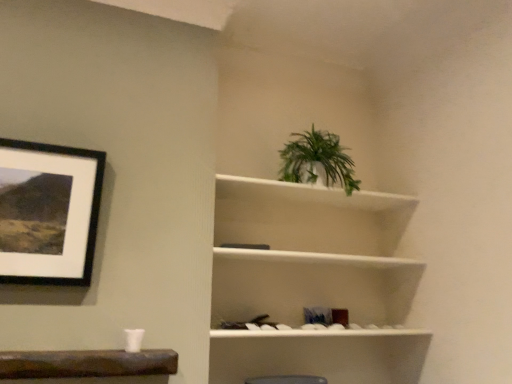
At what (x,y) coordinates should I click in order to perform the action: click on green leafy plant at upper center. Please return your answer as a coordinate pair (x, y). Looking at the image, I should click on (318, 161).

What do you see at coordinates (318, 161) in the screenshot? This screenshot has width=512, height=384. I see `green leafy plant at upper center` at bounding box center [318, 161].

The width and height of the screenshot is (512, 384). What do you see at coordinates (313, 282) in the screenshot?
I see `white matte shelf at upper right` at bounding box center [313, 282].

Where is `green leafy plant at upper center`? The height and width of the screenshot is (384, 512). green leafy plant at upper center is located at coordinates (318, 161).

From the image's perspective, which one is positioned lower, white matte shelf at upper right or black matte picture frame at upper left?

white matte shelf at upper right is shown below in the image.

Between white matte shelf at upper right and black matte picture frame at upper left, which one has larger width?

white matte shelf at upper right.

Measure the distance from white matte shelf at upper right to black matte picture frame at upper left.

They are 37.46 inches apart.

Is white matte shelf at upper right not within black matte picture frame at upper left?

Yes, white matte shelf at upper right is not within black matte picture frame at upper left.

Does point (89, 264) come farther from viewer compared to point (217, 298)?

No.

Considering their positions, is black matte picture frame at upper left located in front of or behind white matte shelf at upper right?

In the image, black matte picture frame at upper left appears in front of white matte shelf at upper right.

From the image's perspective, which one is positioned higher, black matte picture frame at upper left or white matte shelf at upper right?

black matte picture frame at upper left.

Is black matte picture frame at upper left not within white matte shelf at upper right?

Yes, black matte picture frame at upper left is not within white matte shelf at upper right.

From the picture: Who is taller, white matte shelf at upper right or green leafy plant at upper center?

Standing taller between the two is white matte shelf at upper right.

Which object is further away from the camera, white matte shelf at upper right or green leafy plant at upper center?

green leafy plant at upper center.

Considering the sizes of white matte shelf at upper right and green leafy plant at upper center in the image, is white matte shelf at upper right wider or thinner than green leafy plant at upper center?

white matte shelf at upper right is wider than green leafy plant at upper center.

From a real-world perspective, is white matte shelf at upper right above or below green leafy plant at upper center?

In terms of real-world spatial position, white matte shelf at upper right is below green leafy plant at upper center.

From a real-world perspective, which is physically below, green leafy plant at upper center or black matte picture frame at upper left?

black matte picture frame at upper left.

This screenshot has height=384, width=512. Find the location of `houseplant above the black matte picture frame at upper left (from a real-world perspective)`. houseplant above the black matte picture frame at upper left (from a real-world perspective) is located at coordinates (318, 161).

Is green leafy plant at upper center closer to camera compared to black matte picture frame at upper left?

No, it is not.

What's the angular difference between green leafy plant at upper center and black matte picture frame at upper left's facing directions?

The angular difference between green leafy plant at upper center and black matte picture frame at upper left is 0.245 degrees.

Can you tell me how much black matte picture frame at upper left and green leafy plant at upper center differ in facing direction?

The facing directions of black matte picture frame at upper left and green leafy plant at upper center are 0.245 degrees apart.

Can you confirm if black matte picture frame at upper left is taller than green leafy plant at upper center?

Yes.

Is black matte picture frame at upper left far away from green leafy plant at upper center?

Absolutely, black matte picture frame at upper left is distant from green leafy plant at upper center.

From a real-world perspective, between black matte picture frame at upper left and green leafy plant at upper center, who is vertically higher?

In real-world perspective, green leafy plant at upper center is above.

From a real-world perspective, which is physically below, green leafy plant at upper center or white matte shelf at upper right?

white matte shelf at upper right.

Is green leafy plant at upper center oriented towards white matte shelf at upper right?

No, green leafy plant at upper center is not turned towards white matte shelf at upper right.

Considering the relative sizes of green leafy plant at upper center and white matte shelf at upper right in the image provided, is green leafy plant at upper center smaller than white matte shelf at upper right?

Correct, green leafy plant at upper center occupies less space than white matte shelf at upper right.

Which of these two, green leafy plant at upper center or white matte shelf at upper right, stands taller?

With more height is white matte shelf at upper right.

The image size is (512, 384). I want to click on shelf below the black matte picture frame at upper left (from the image's perspective), so click(313, 282).

Identify the location of picture frame above the white matte shelf at upper right (from a real-world perspective). (49, 213).

From the image, which object appears to be farther from black matte picture frame at upper left, green leafy plant at upper center or white matte shelf at upper right?

Based on the image, green leafy plant at upper center appears to be further to black matte picture frame at upper left.

When comparing their distances from white matte shelf at upper right, does green leafy plant at upper center or black matte picture frame at upper left seem further?

Based on the image, black matte picture frame at upper left appears to be further to white matte shelf at upper right.

When comparing their distances from green leafy plant at upper center, does white matte shelf at upper right or black matte picture frame at upper left seem further?

Among the two, black matte picture frame at upper left is located further to green leafy plant at upper center.

Which object lies further to the anchor point white matte shelf at upper right, black matte picture frame at upper left or green leafy plant at upper center?

The object further to white matte shelf at upper right is black matte picture frame at upper left.

Based on their spatial positions, is black matte picture frame at upper left or white matte shelf at upper right closer to green leafy plant at upper center?

white matte shelf at upper right is closer to green leafy plant at upper center.

When comparing their distances from black matte picture frame at upper left, does white matte shelf at upper right or green leafy plant at upper center seem further?

green leafy plant at upper center lies further to black matte picture frame at upper left than the other object.

Where is `shelf between black matte picture frame at upper left and green leafy plant at upper center in the horizontal direction`? The image size is (512, 384). shelf between black matte picture frame at upper left and green leafy plant at upper center in the horizontal direction is located at coordinates (313, 282).